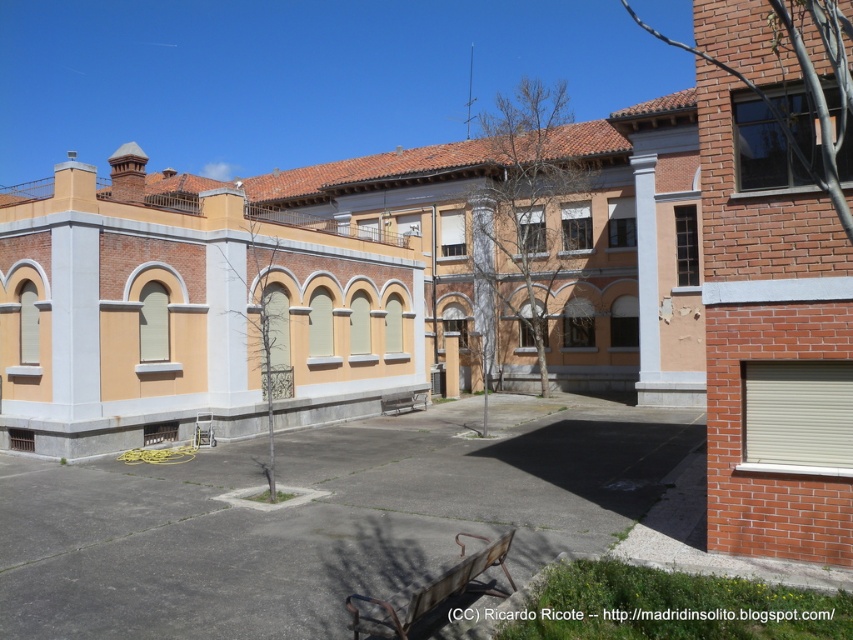
Question: Can you confirm if rustic wood park bench at lower center is bigger than metallic silver bench at center?

Choices:
 (A) yes
 (B) no

Answer: (A)

Question: Is rustic wood park bench at lower center further to the viewer compared to metallic silver bench at center?

Choices:
 (A) yes
 (B) no

Answer: (B)

Question: Among these objects, which one is nearest to the camera?

Choices:
 (A) metallic silver bench at center
 (B) rustic wood park bench at lower center

Answer: (B)

Question: Considering the relative positions of rustic wood park bench at lower center and metallic silver bench at center in the image provided, where is rustic wood park bench at lower center located with respect to metallic silver bench at center?

Choices:
 (A) below
 (B) above

Answer: (B)